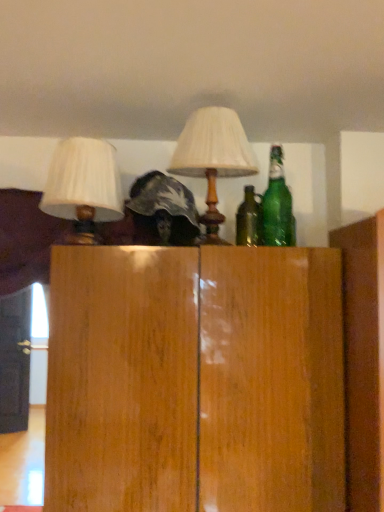
Question: Can matte white lampshade at center, the 1th lamp when ordered from right to left, be found inside green glass bottle at upper right?

Choices:
 (A) yes
 (B) no

Answer: (B)

Question: Considering the relative positions of green glass bottle at upper right and matte white lampshade at center, the 1th lamp when ordered from right to left, in the image provided, is green glass bottle at upper right to the right of matte white lampshade at center, the 1th lamp when ordered from right to left, from the viewer's perspective?

Choices:
 (A) no
 (B) yes

Answer: (B)

Question: Considering the relative sizes of green glass bottle at upper right and matte white lampshade at center, the 1th lamp when ordered from right to left, in the image provided, is green glass bottle at upper right shorter than matte white lampshade at center, the 1th lamp when ordered from right to left,?

Choices:
 (A) no
 (B) yes

Answer: (B)

Question: From a real-world perspective, is green glass bottle at upper right beneath matte white lampshade at center, the 1th lamp when ordered from right to left?

Choices:
 (A) yes
 (B) no

Answer: (A)

Question: Is the depth of green glass bottle at upper right greater than that of matte white lampshade at center, the 1th lamp when ordered from right to left?

Choices:
 (A) no
 (B) yes

Answer: (B)

Question: In terms of size, does matte white lampshade at center, the 1th lamp when ordered from right to left, appear bigger or smaller than white fabric lampshade at upper left, the 2th lamp from the right?

Choices:
 (A) big
 (B) small

Answer: (A)

Question: Does point (233, 134) appear closer or farther from the camera than point (86, 158)?

Choices:
 (A) closer
 (B) farther

Answer: (B)

Question: Considering the positions of matte white lampshade at center, the 1th lamp when ordered from right to left, and white fabric lampshade at upper left, the 2th lamp from the right, in the image, is matte white lampshade at center, the 1th lamp when ordered from right to left, wider or thinner than white fabric lampshade at upper left, the 2th lamp from the right,?

Choices:
 (A) thin
 (B) wide

Answer: (B)

Question: From a real-world perspective, is matte white lampshade at center, the 1th lamp when ordered from right to left, positioned above or below white fabric lampshade at upper left, the 2th lamp from the right?

Choices:
 (A) above
 (B) below

Answer: (A)

Question: From the image's perspective, relative to green glass bottle at upper right, is white fabric lampshade at upper left, the 2th lamp from the right, above or below?

Choices:
 (A) above
 (B) below

Answer: (B)

Question: Is point (69, 214) positioned closer to the camera than point (284, 201)?

Choices:
 (A) farther
 (B) closer

Answer: (B)

Question: Is white fabric lampshade at upper left, which ranks as the 1th lamp in left-to-right order, wider or thinner than green glass bottle at upper right?

Choices:
 (A) thin
 (B) wide

Answer: (B)

Question: In the image, is white fabric lampshade at upper left, which ranks as the 1th lamp in left-to-right order, on the left side or the right side of green glass bottle at upper right?

Choices:
 (A) left
 (B) right

Answer: (A)

Question: Considering the positions of point (291, 242) and point (13, 312), is point (291, 242) closer or farther from the camera than point (13, 312)?

Choices:
 (A) farther
 (B) closer

Answer: (B)

Question: From a real-world perspective, is green glass bottle at upper right above or below wooden door at left?

Choices:
 (A) below
 (B) above

Answer: (B)